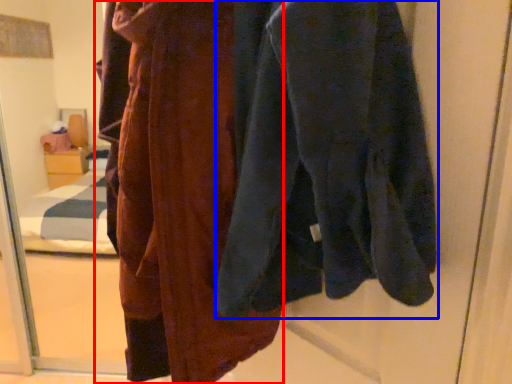
Question: Among these objects, which one is nearest to the camera, fancy dress (highlighted by a red box) or sweatshirt (highlighted by a blue box)?

Choices:
 (A) fancy dress
 (B) sweatshirt

Answer: (B)